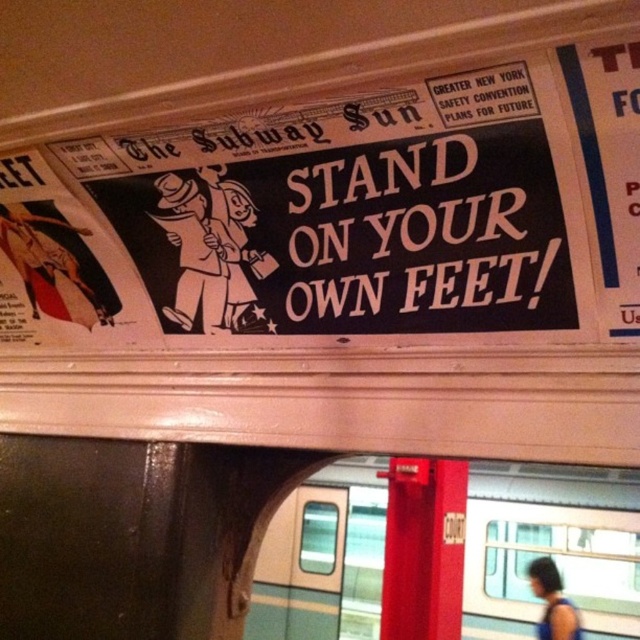
Between black paper sign at upper center and whitematerial/texture sign at center, which one appears on the right side from the viewer's perspective?

whitematerial/texture sign at center

Between black paper sign at upper center and whitematerial/texture sign at center, which one is positioned higher?

black paper sign at upper center is above.

Measure the distance between black paper sign at upper center and camera.

black paper sign at upper center is 36.55 inches from camera.

Identify the location of black paper sign at upper center. (308, 225).

Who is lower down, black paper sign at upper center or teal glossy train at center?

teal glossy train at center is below.

Is black paper sign at upper center wider than teal glossy train at center?

Yes, black paper sign at upper center is wider than teal glossy train at center.

Describe the element at coordinates (308, 225) in the screenshot. I see `black paper sign at upper center` at that location.

This screenshot has height=640, width=640. In order to click on black paper sign at upper center in this screenshot , I will do `click(308, 225)`.

Who is positioned more to the left, whitematerial/texture sign at center or dark blue fabric at lower right?

From the viewer's perspective, whitematerial/texture sign at center appears more on the left side.

Who is shorter, whitematerial/texture sign at center or dark blue fabric at lower right?

With less height is whitematerial/texture sign at center.

At what (x,y) coordinates should I click in order to perform the action: click on whitematerial/texture sign at center. Please return your answer as a coordinate pair (x, y). The width and height of the screenshot is (640, 640). Looking at the image, I should click on (428, 236).